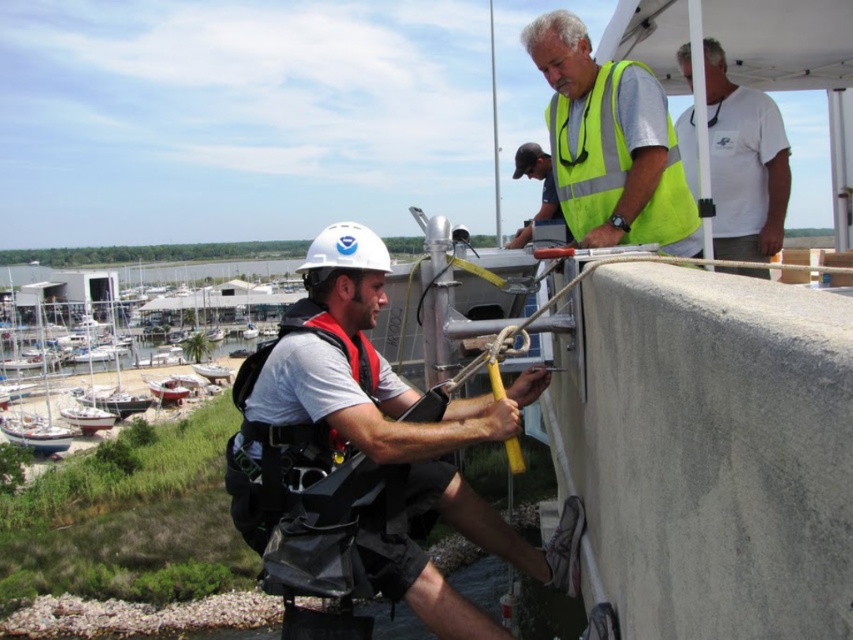
You are a safety inspector at the marina and need to check the equipment of the workers. Which worker is nearer to you, the one wearing the yellow reflective vest at upper right or the one with the dark gray baseball cap at upper center?

The yellow reflective vest at upper right is closer to the viewer than the dark gray baseball cap at upper center, so the worker in the yellow reflective vest at upper right is nearer.

You are standing at the point labeled point [426,474] and want to move to the point labeled point [519,168]. Which direction should you face to walk towards your destination?

You should face north to walk towards point [519,168] from point [426,474].

Consider the image. You are a safety inspector at the marina. You need to ensure that all safety equipment is properly positioned. According to the scene, is the white matte helmet at center located to the left or right of the neon yellow reflective vest at upper center?

The white matte helmet at center is to the left of the neon yellow reflective vest at upper center.